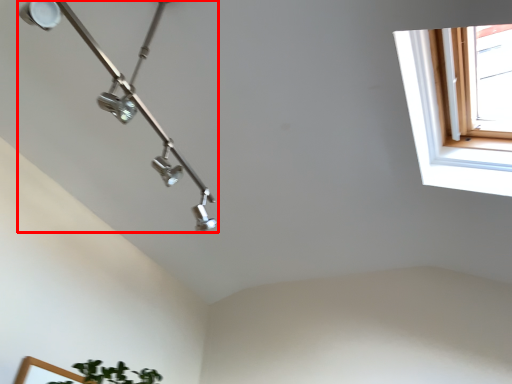
Question: From the image's perspective, considering the relative positions of lamp (annotated by the red box) and window in the image provided, where is lamp (annotated by the red box) located with respect to the staircase?

Choices:
 (A) above
 (B) below

Answer: (B)